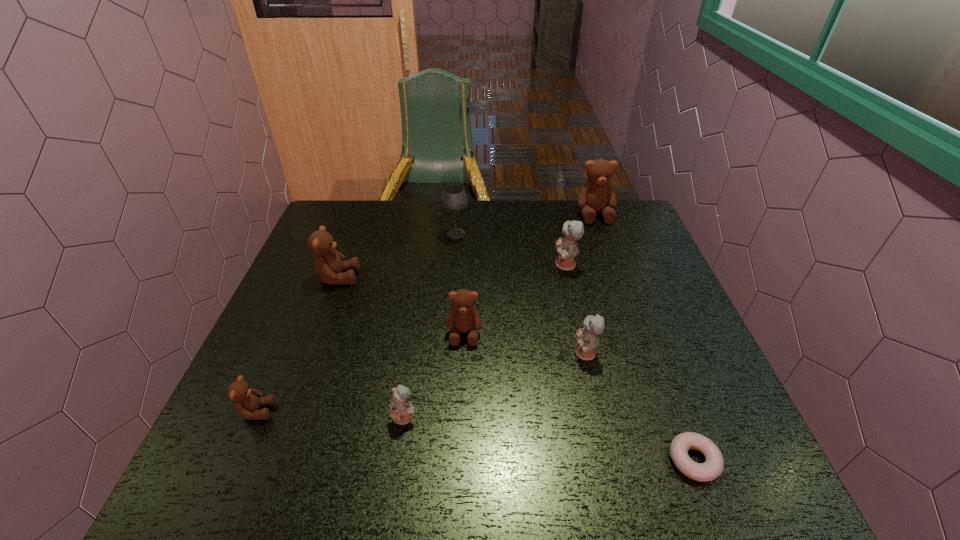
In order to click on doughnut at the right edge in this screenshot , I will do pos(713,466).

You are a GUI agent. You are given a task and a screenshot of the screen. Output one action in this format:
    pyautogui.click(x=<x>, y=<y>)
    Task: Click on the object located in the far right corner section of the desktop
    
    Given the screenshot: What is the action you would take?
    pyautogui.click(x=597, y=194)

Where is `object at the near right corner`? Image resolution: width=960 pixels, height=540 pixels. object at the near right corner is located at coordinates (713, 466).

In order to click on free space at the far edge of the desktop in this screenshot , I will do `click(563, 224)`.

In the image, there is a desktop. Where is `vacant space at the near edge`? The height and width of the screenshot is (540, 960). vacant space at the near edge is located at coordinates (469, 465).

In order to click on free space at the left edge in this screenshot , I will do `click(316, 301)`.

You are a GUI agent. You are given a task and a screenshot of the screen. Output one action in this format:
    pyautogui.click(x=<x>, y=<y>)
    Task: Click on the vacant space at the right edge
    The image size is (960, 540).
    Given the screenshot: What is the action you would take?
    pyautogui.click(x=634, y=260)

This screenshot has height=540, width=960. In order to click on vacant space at the far left corner in this screenshot , I will do `click(331, 207)`.

The image size is (960, 540). I want to click on blank space at the far right corner of the desktop, so click(618, 229).

I want to click on vacant area that lies between the second smallest blue teddy bear and the farthest blue teddy bear, so click(x=575, y=309).